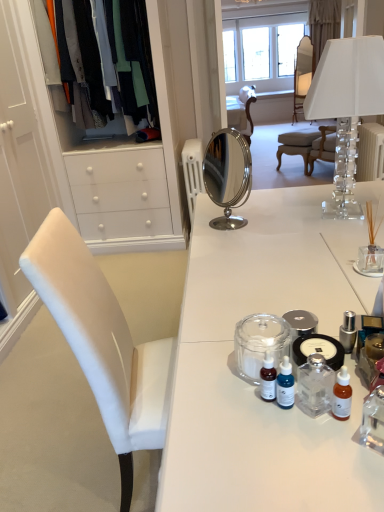
Question: Looking at their shapes, would you say matte white chair at center, the 1th chair from the top, is wider or thinner than white fabric curtain at upper center?

Choices:
 (A) wide
 (B) thin

Answer: (B)

Question: From their relative heights in the image, would you say matte white chair at center, which is the 2th chair in front-to-back order, is taller or shorter than white fabric curtain at upper center?

Choices:
 (A) short
 (B) tall

Answer: (A)

Question: Which is nearer to the light brown wooden chair at center, positioned as the 2th chair in right-to-left order?

Choices:
 (A) white fabric curtain at upper center
 (B) clear glass bottle at center
 (C) transparent glass jar at center
 (D) blue glass dropper bottle at center, which is the 1th toiletry in front-to-back order
 (E) matte white chair at center, placed as the second chair when sorted from bottom to top

Answer: (A)

Question: Which is nearer to the clear glass bottle at center?

Choices:
 (A) blue glass dropper bottle at center, which is the 1th toiletry in front-to-back order
 (B) transparent glass jar at center
 (C) light brown wooden chair at center, which is the second chair from top to bottom
 (D) matte white chair at center, which is the 1th chair in right-to-left order
 (E) silver metallic container at center-right, the first toiletry in the right-to-left sequence

Answer: (A)